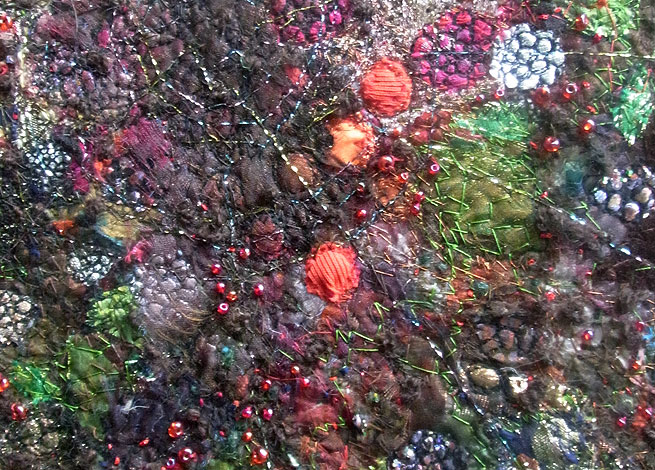
Locate an element on the screen. This screenshot has height=470, width=655. picture is located at coordinates (327, 204).